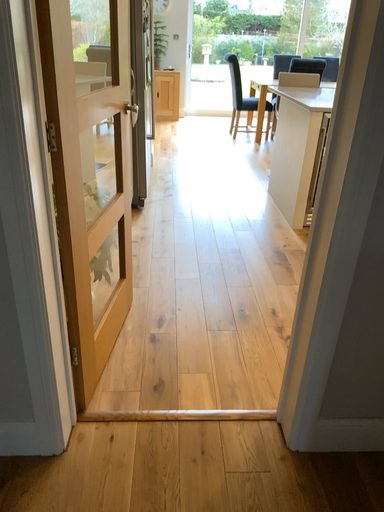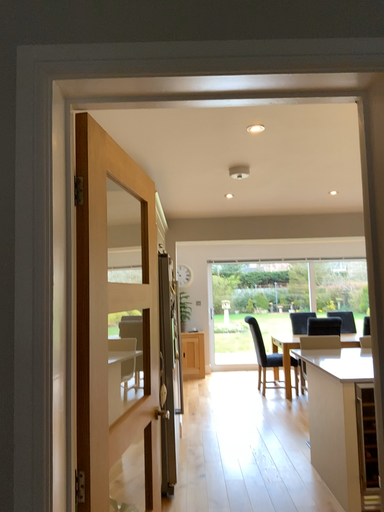
Question: How did the camera likely rotate when shooting the video?

Choices:
 (A) rotated downward
 (B) rotated upward

Answer: (B)